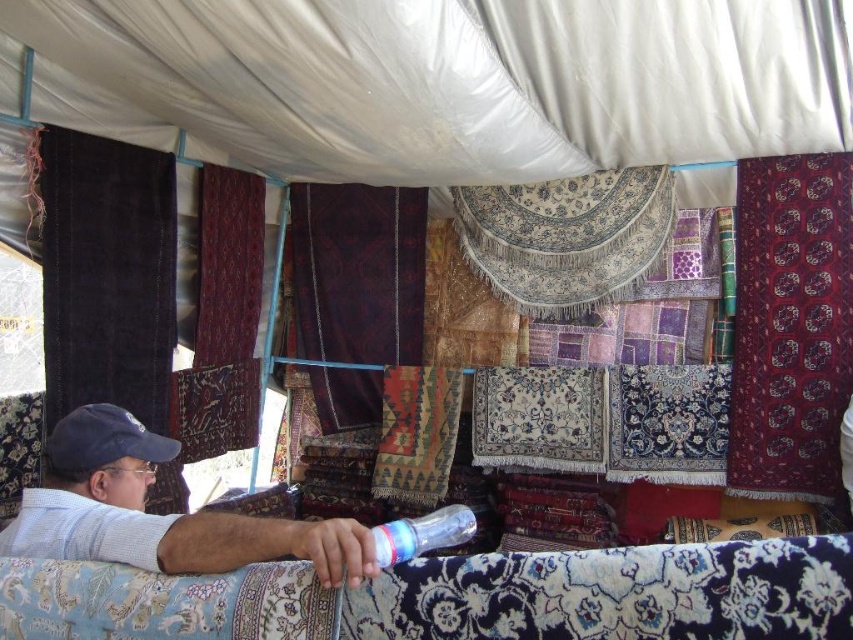
Can you confirm if white cotton shirt at center is taller than dark red woven rug at center?

In fact, white cotton shirt at center may be shorter than dark red woven rug at center.

Does white cotton shirt at center appear over dark red woven rug at center?

No, white cotton shirt at center is not above dark red woven rug at center.

The width and height of the screenshot is (853, 640). Find the location of `white cotton shirt at center`. white cotton shirt at center is located at coordinates (157, 515).

Which of these two, black velvet rug at left or dark velvet rug at center, stands shorter?

black velvet rug at left

Which is in front, point (94, 355) or point (321, 230)?

Positioned in front is point (94, 355).

Is point (39, 150) more distant than point (334, 234)?

No, it is not.

This screenshot has height=640, width=853. I want to click on black velvet rug at left, so click(107, 275).

Which is below, white cotton shirt at center or dark velvet rug at center?

white cotton shirt at center is below.

Does white cotton shirt at center appear over dark velvet rug at center?

No, white cotton shirt at center is not above dark velvet rug at center.

Which is in front, point (84, 496) or point (404, 189)?

Point (84, 496) is more forward.

You are a GUI agent. You are given a task and a screenshot of the screen. Output one action in this format:
    pyautogui.click(x=<x>, y=<y>)
    Task: Click on the white cotton shirt at center
    The width and height of the screenshot is (853, 640).
    Given the screenshot: What is the action you would take?
    pyautogui.click(x=157, y=515)